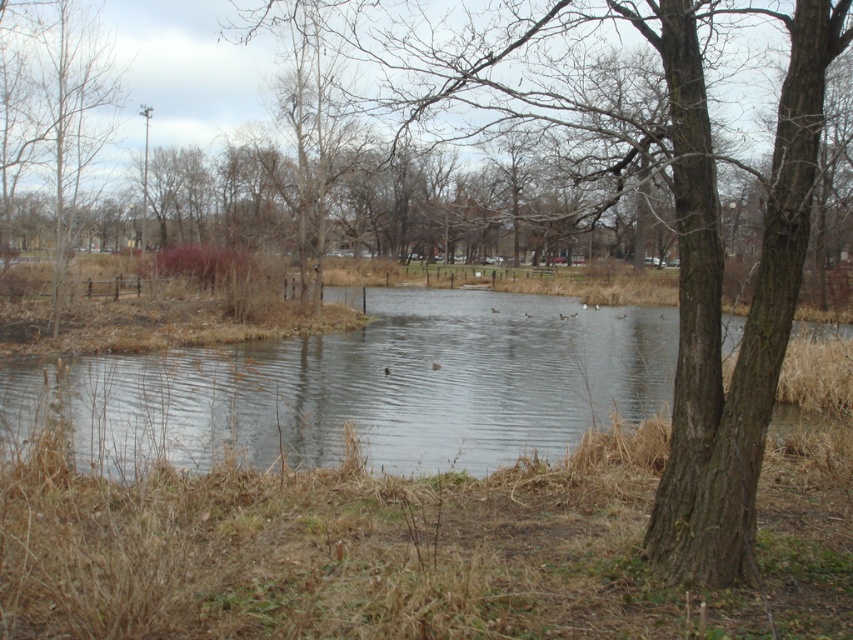
Describe the element at coordinates (718, 294) in the screenshot. I see `brown rough tree at center` at that location.

Looking at this image, does brown rough tree at center have a larger size compared to brown bark tree at upper left?

No.

Is point (677, 404) in front of point (4, 1)?

Yes, point (677, 404) is in front of point (4, 1).

Find the location of `brown rough tree at center`. brown rough tree at center is located at coordinates (718, 294).